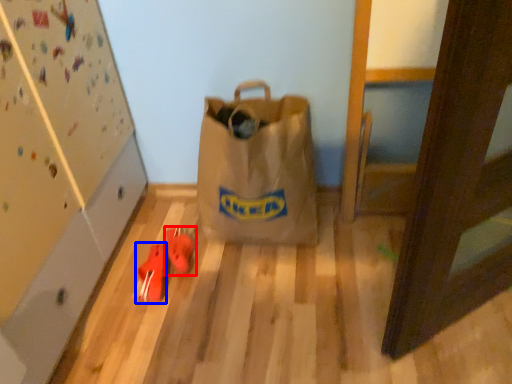
Question: Which object appears closest to the camera in this image, footwear (highlighted by a red box) or footwear (highlighted by a blue box)?

Choices:
 (A) footwear
 (B) footwear

Answer: (B)